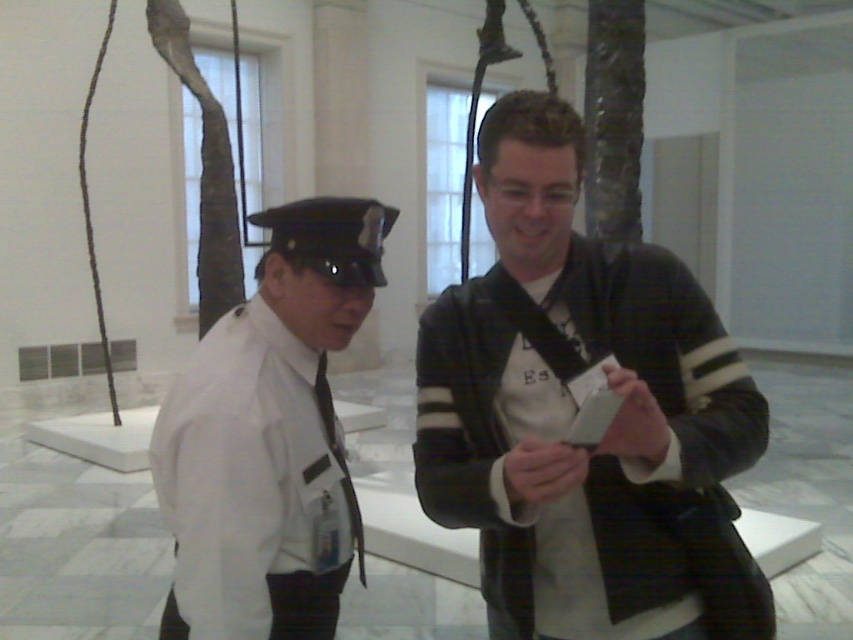
You are a visitor in the museum and want to locate the white smooth shirt at left and the black leather jacket at center. According to the scene, which one is positioned more to the left side?

The white smooth shirt at left is positioned more to the left side than the black leather jacket at center.

You are standing in the museum and want to touch the point at coordinates point (711, 625). However, the museum has a rule that you must stay at least 1.5 meters away from any exhibit. Can you safely touch the point without breaking the rule?

The distance between you and the point (711, 625) is 1.21 meters, which is less than the required 1.5 meters. Therefore, touching the point would violate the museum rule.

You are a tailor measuring clothing items in a museum. You have a tailor measuring tape. You need to determine which clothing item between the black leather jacket at center and the white smooth shirt at left requires a wider measurement. Which one should you measure first?

The black leather jacket at center has a greater width than the white smooth shirt at left, so you should measure the black leather jacket at center first.